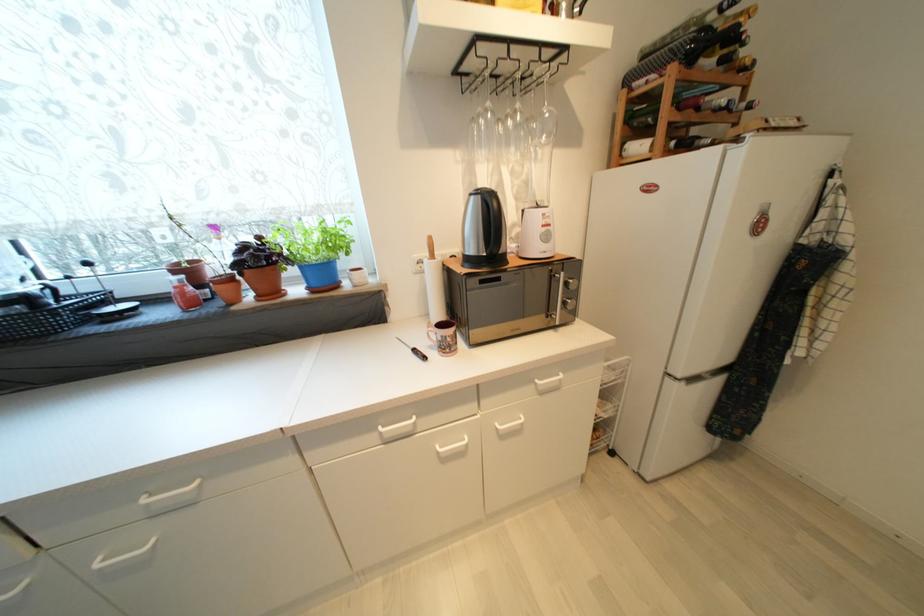
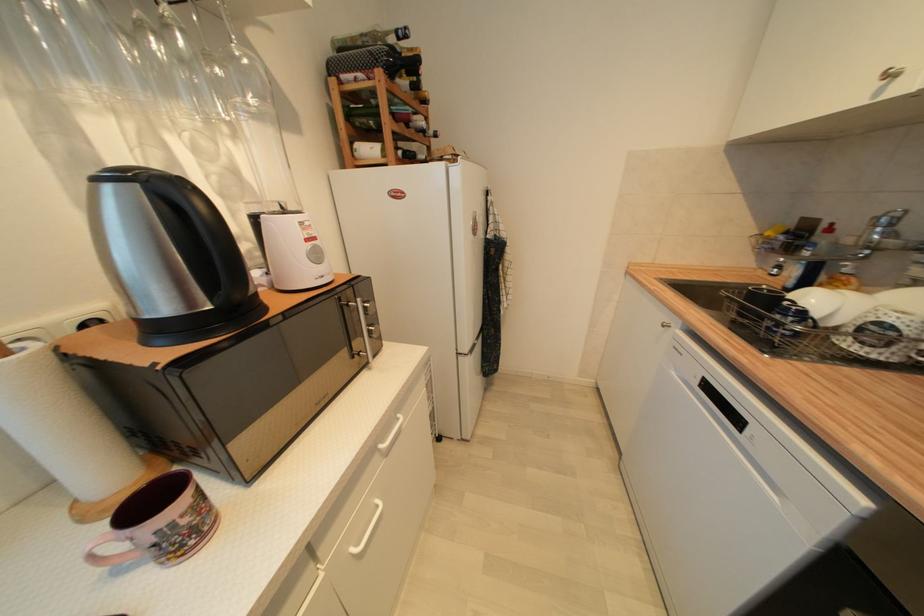
Question: The first image is from the beginning of the video and the second image is from the end. How did the camera likely rotate when shooting the video?

Choices:
 (A) Left
 (B) Right
 (C) Up
 (D) Down

Answer: (B)